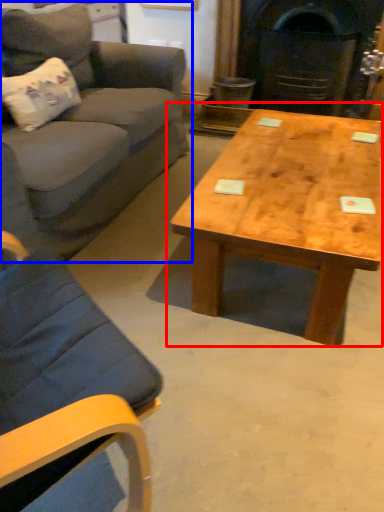
Question: Which point is further to the camera, coffee table (highlighted by a red box) or studio couch (highlighted by a blue box)?

Choices:
 (A) coffee table
 (B) studio couch

Answer: (A)